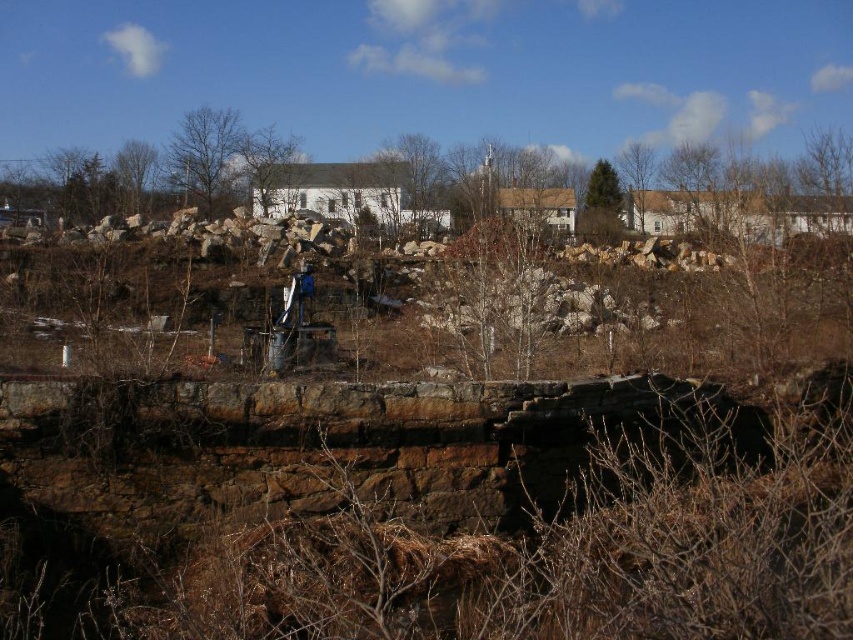
You are standing at the base of the brown leafless tree at upper right and want to throw a ball to a friend who is 50 meters away from you. Can you reach your friend with one throw?

The brown leafless tree at upper right is 47.40 meters away from the camera. Since your friend is 50 meters away from you, you would need to throw the ball an additional 2.6 meters beyond the tree to reach them.